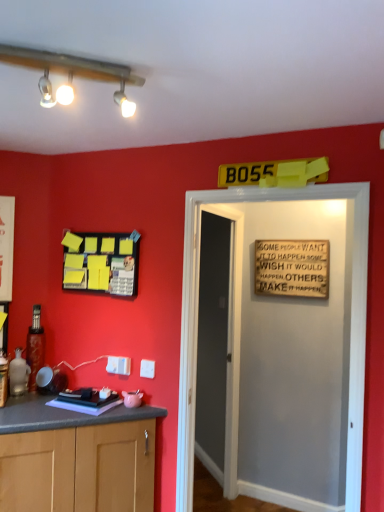
Locate an element on the screen. Image resolution: width=384 pixels, height=512 pixels. smooth gray door at center, positioned as the 1th door in back-to-front order is located at coordinates (218, 349).

In order to click on wooden sign at upper center in this screenshot , I will do `click(292, 268)`.

In order to face yellow matte bulletin board at upper left, should I rotate leftwards or rightwards?

To face it directly, rotate left by 12.198 degrees.

What do you see at coordinates (101, 263) in the screenshot?
I see `yellow matte bulletin board at upper left` at bounding box center [101, 263].

Locate an element on the screen. The image size is (384, 512). smooth gray door at center, the second door in the front-to-back sequence is located at coordinates (218, 349).

From the image's perspective, which one is positioned lower, wooden signboard at center, the 2th door viewed from the back, or yellow matte bulletin board at upper left?

wooden signboard at center, the 2th door viewed from the back, from the image's perspective.

Is wooden signboard at center, which is the 1th door in front-to-back order, completely or partially outside of yellow matte bulletin board at upper left?

wooden signboard at center, which is the 1th door in front-to-back order, lies outside yellow matte bulletin board at upper left's area.

Is wooden signboard at center, which is the 1th door in front-to-back order, bigger or smaller than yellow matte bulletin board at upper left?

Considering their sizes, wooden signboard at center, which is the 1th door in front-to-back order, takes up more space than yellow matte bulletin board at upper left.

Is wooden signboard at center, which is the 1th door in front-to-back order, directly adjacent to yellow matte bulletin board at upper left?

They are not placed beside each other.

Does wooden sign at upper center turn towards wooden signboard at center, the 2th door viewed from the back?

Yes, wooden sign at upper center faces towards wooden signboard at center, the 2th door viewed from the back.

Which is more to the left, wooden sign at upper center or wooden signboard at center, which is the 1th door in front-to-back order?

wooden signboard at center, which is the 1th door in front-to-back order.

Can you see wooden sign at upper center touching wooden signboard at center, the 2th door viewed from the back?

No.

From a real-world perspective, between wooden sign at upper center and wooden signboard at center, which is the 1th door in front-to-back order, who is vertically higher?

From a 3D spatial view, wooden sign at upper center is above.

Is the depth of yellow matte bulletin board at upper left greater than that of smooth gray door at center, the second door in the front-to-back sequence?

Yes, it is behind smooth gray door at center, the second door in the front-to-back sequence.

Based on the photo, between yellow matte bulletin board at upper left and smooth gray door at center, the second door in the front-to-back sequence, which one has smaller size?

yellow matte bulletin board at upper left.

Does point (126, 289) come farther from viewer compared to point (223, 224)?

No, it is in front of (223, 224).

Is wooden sign at upper center shorter than smooth gray door at center, the second door in the front-to-back sequence?

Yes, wooden sign at upper center is shorter than smooth gray door at center, the second door in the front-to-back sequence.

From a real-world perspective, count 2nd doors downward from the wooden sign at upper center and point to it. Please provide its 2D coordinates.

[(218, 349)]

Is wooden sign at upper center oriented away from smooth gray door at center, positioned as the 1th door in back-to-front order?

That's not correct — wooden sign at upper center is not looking away from smooth gray door at center, positioned as the 1th door in back-to-front order.

Could smooth gray door at center, positioned as the 1th door in back-to-front order, be considered to be inside wooden sign at upper center?

No, wooden sign at upper center does not contain smooth gray door at center, positioned as the 1th door in back-to-front order.

Considering the sizes of objects smooth gray door at center, positioned as the 1th door in back-to-front order, and yellow matte bulletin board at upper left in the image provided, who is wider, smooth gray door at center, positioned as the 1th door in back-to-front order, or yellow matte bulletin board at upper left?

Wider between the two is smooth gray door at center, positioned as the 1th door in back-to-front order.

From the image's perspective, which door is the 2nd one below the yellow matte bulletin board at upper left? Please provide its 2D coordinates.

[(218, 349)]

From the image's perspective, does smooth gray door at center, the second door in the front-to-back sequence, appear higher than yellow matte bulletin board at upper left?

Actually, smooth gray door at center, the second door in the front-to-back sequence, appears below yellow matte bulletin board at upper left in the image.

Are smooth gray door at center, positioned as the 1th door in back-to-front order, and yellow matte bulletin board at upper left located far from each other?

Yes, smooth gray door at center, positioned as the 1th door in back-to-front order, is far from yellow matte bulletin board at upper left.

Between wooden signboard at center, the 2th door viewed from the back, and wooden sign at upper center, which one appears on the right side from the viewer's perspective?

wooden sign at upper center is more to the right.

Is wooden sign at upper center completely or partially inside wooden signboard at center, which is the 1th door in front-to-back order?

Definitely not — wooden sign at upper center is not inside wooden signboard at center, which is the 1th door in front-to-back order.

Considering the relative sizes of wooden signboard at center, the 2th door viewed from the back, and wooden sign at upper center in the image provided, is wooden signboard at center, the 2th door viewed from the back, taller than wooden sign at upper center?

Yes.

From the image's perspective, is wooden signboard at center, which is the 1th door in front-to-back order, above wooden sign at upper center?

Actually, wooden signboard at center, which is the 1th door in front-to-back order, appears below wooden sign at upper center in the image.

Which object is positioned more to the left, yellow matte bulletin board at upper left or wooden signboard at center, which is the 1th door in front-to-back order?

yellow matte bulletin board at upper left.

Is yellow matte bulletin board at upper left bigger or smaller than wooden signboard at center, the 2th door viewed from the back?

Considering their sizes, yellow matte bulletin board at upper left takes up less space than wooden signboard at center, the 2th door viewed from the back.

In the scene shown: Which of these two, yellow matte bulletin board at upper left or wooden signboard at center, which is the 1th door in front-to-back order, is thinner?

Thinner between the two is yellow matte bulletin board at upper left.

Is point (85, 242) more distant than point (357, 333)?

Yes, point (85, 242) is behind point (357, 333).

From the image's perspective, count 1st doors downward from the yellow matte bulletin board at upper left and point to it. Please provide its 2D coordinates.

[(197, 322)]

Where is `warning sign above the wooden signboard at center, which is the 1th door in front-to-back order (from the image's perspective)`? The height and width of the screenshot is (512, 384). warning sign above the wooden signboard at center, which is the 1th door in front-to-back order (from the image's perspective) is located at coordinates (292, 268).

Based on their spatial positions, is wooden signboard at center, the 2th door viewed from the back, or wooden sign at upper center further from smooth gray door at center, the second door in the front-to-back sequence?

The object further to smooth gray door at center, the second door in the front-to-back sequence, is wooden signboard at center, the 2th door viewed from the back.

Which object lies nearer to the anchor point smooth gray door at center, the second door in the front-to-back sequence, wooden sign at upper center or wooden signboard at center, which is the 1th door in front-to-back order?

Among the two, wooden sign at upper center is located nearer to smooth gray door at center, the second door in the front-to-back sequence.

Considering their positions, is wooden sign at upper center positioned further to yellow matte bulletin board at upper left than smooth gray door at center, the second door in the front-to-back sequence?

Based on the image, wooden sign at upper center appears to be further to yellow matte bulletin board at upper left.

From the image, which object appears to be farther from smooth gray door at center, the second door in the front-to-back sequence, wooden sign at upper center or yellow matte bulletin board at upper left?

yellow matte bulletin board at upper left.

Looking at the image, which one is located closer to yellow matte bulletin board at upper left, wooden sign at upper center or wooden signboard at center, which is the 1th door in front-to-back order?

wooden signboard at center, which is the 1th door in front-to-back order, is positioned closer to the anchor yellow matte bulletin board at upper left.

Looking at the image, which one is located further to wooden sign at upper center, smooth gray door at center, positioned as the 1th door in back-to-front order, or wooden signboard at center, which is the 1th door in front-to-back order?

wooden signboard at center, which is the 1th door in front-to-back order, is positioned further to the anchor wooden sign at upper center.

Based on their spatial positions, is smooth gray door at center, the second door in the front-to-back sequence, or wooden signboard at center, which is the 1th door in front-to-back order, closer to yellow matte bulletin board at upper left?

wooden signboard at center, which is the 1th door in front-to-back order, lies closer to yellow matte bulletin board at upper left than the other object.

From the image, which object appears to be farther from yellow matte bulletin board at upper left, wooden signboard at center, the 2th door viewed from the back, or wooden sign at upper center?

wooden sign at upper center.

You are a GUI agent. You are given a task and a screenshot of the screen. Output one action in this format:
    pyautogui.click(x=<x>, y=<y>)
    Task: Click on the door between yellow matte bulletin board at upper left and wooden signboard at center, which is the 1th door in front-to-back order, from left to right
    Image resolution: width=384 pixels, height=512 pixels.
    Given the screenshot: What is the action you would take?
    pyautogui.click(x=218, y=349)

Image resolution: width=384 pixels, height=512 pixels. I want to click on door between wooden signboard at center, which is the 1th door in front-to-back order, and wooden sign at upper center in the front-back direction, so click(218, 349).